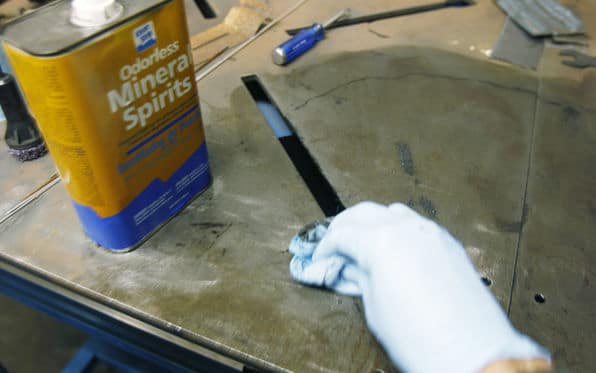
The width and height of the screenshot is (596, 373). I want to click on this back and forth motion is cleaning a surface of a table, so click(331, 249).